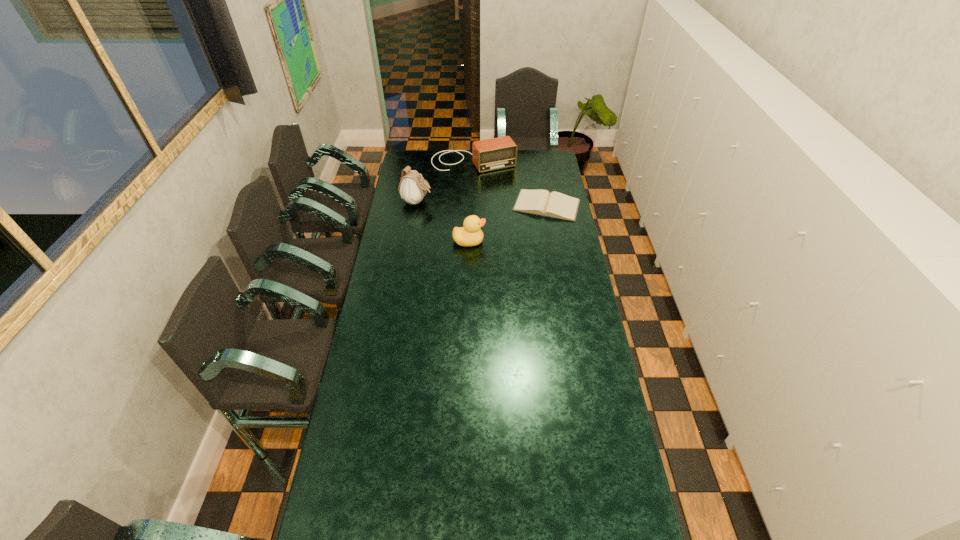
The image size is (960, 540). I want to click on free space on the desktop that is between the duck and the Bible and is positioned on the front-facing side of the tallest object, so click(x=515, y=220).

The width and height of the screenshot is (960, 540). In order to click on vacant spot on the desktop that is between the nearest object and the shortest object and is positioned on the front-facing side of the farthest object in this screenshot , I will do `click(511, 222)`.